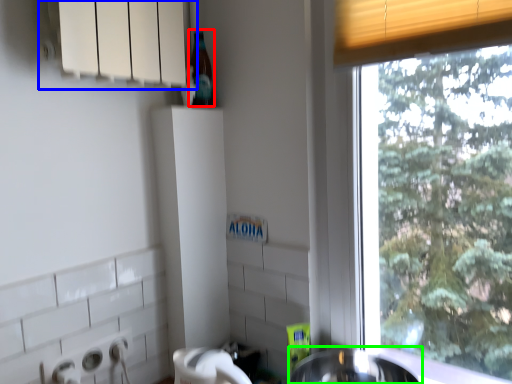
Question: Based on their relative distances, which object is farther from bottle (highlighted by a red box)? Choose from window sill (highlighted by a blue box) and sink (highlighted by a green box).

Choices:
 (A) window sill
 (B) sink

Answer: (B)